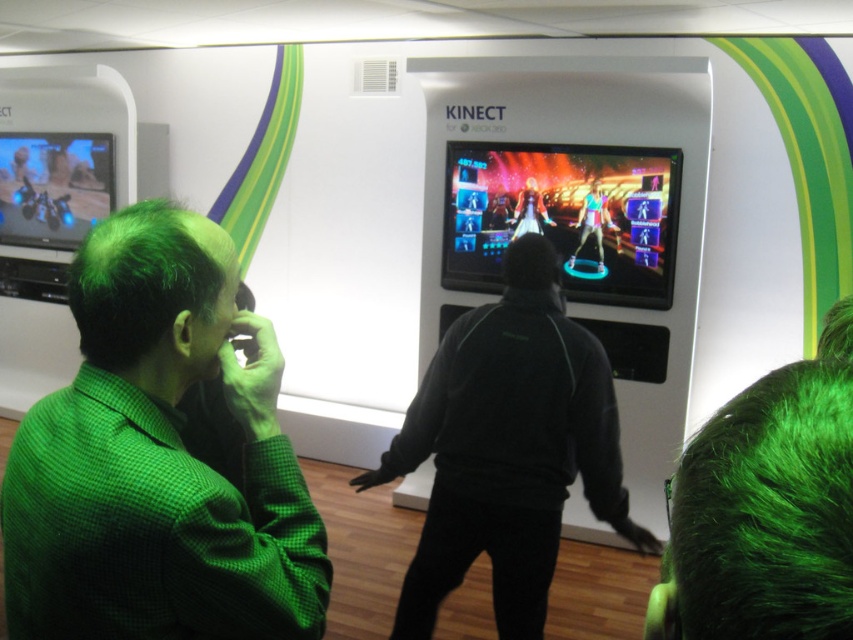
You are a delivery person who needs to place a small package between the black matte jacket at center and the metallic blue motorcycle at left. The package requires a minimum of 3 meters of space to be safely placed. Can you fit the package between them?

The black matte jacket at center and metallic blue motorcycle at left are 3.72 meters apart, which is more than the required 3 meters, so the package can be safely placed between them.